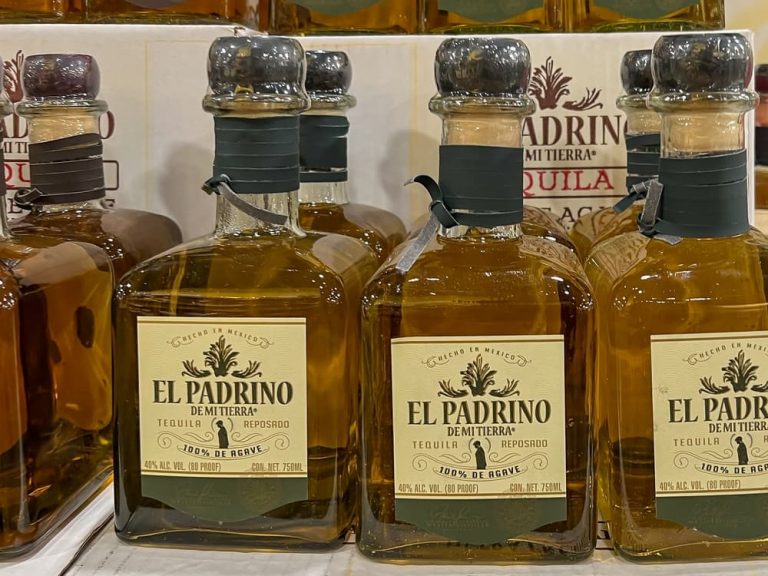
At what (x,y) coordinates should I click in order to perform the action: click on label on tequila bottle. Please return your answer as a coordinate pair (x, y). This screenshot has width=768, height=576. Looking at the image, I should click on (277, 418), (540, 439), (684, 437), (684, 469).